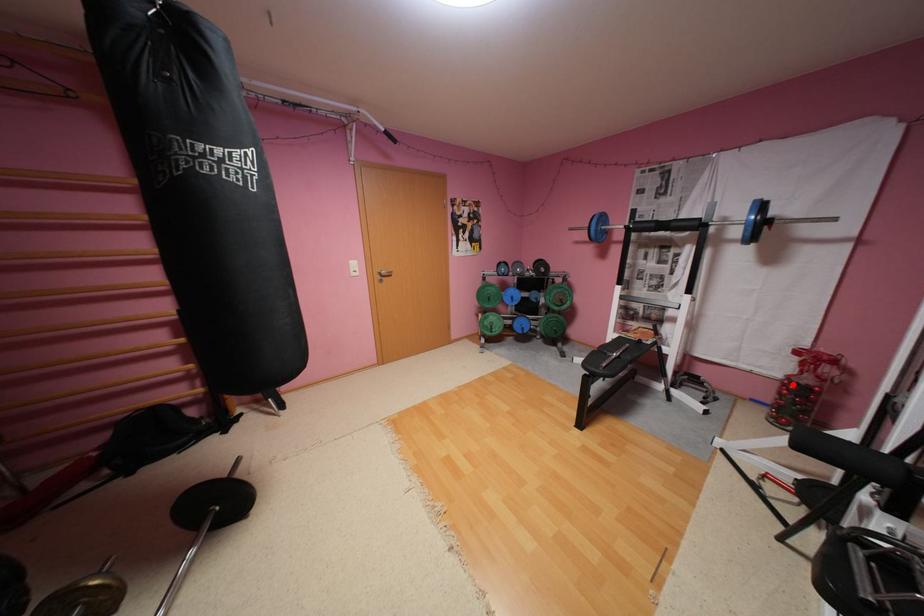
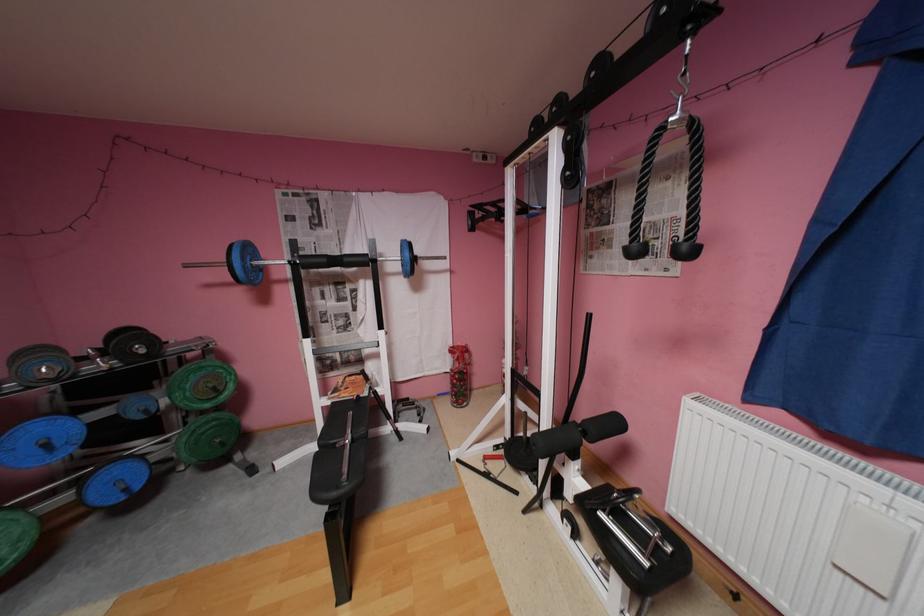
In the second image, find the point that corresponds to the highlighted location in the first image.

(462, 377)